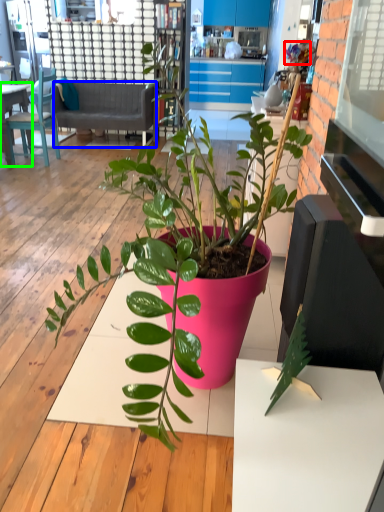
Question: Estimate the real-world distances between objects in this image. Which object is farther from flower (highlighted by a red box), studio couch (highlighted by a blue box) or desk (highlighted by a green box)?

Choices:
 (A) studio couch
 (B) desk

Answer: (B)